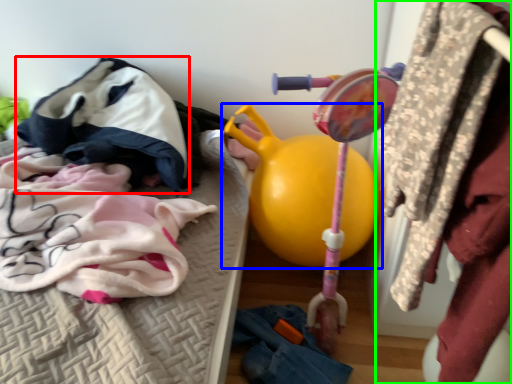
Question: Which is farther away from clothing (highlighted by a red box)? toy (highlighted by a blue box) or closet (highlighted by a green box)?

Choices:
 (A) toy
 (B) closet

Answer: (B)